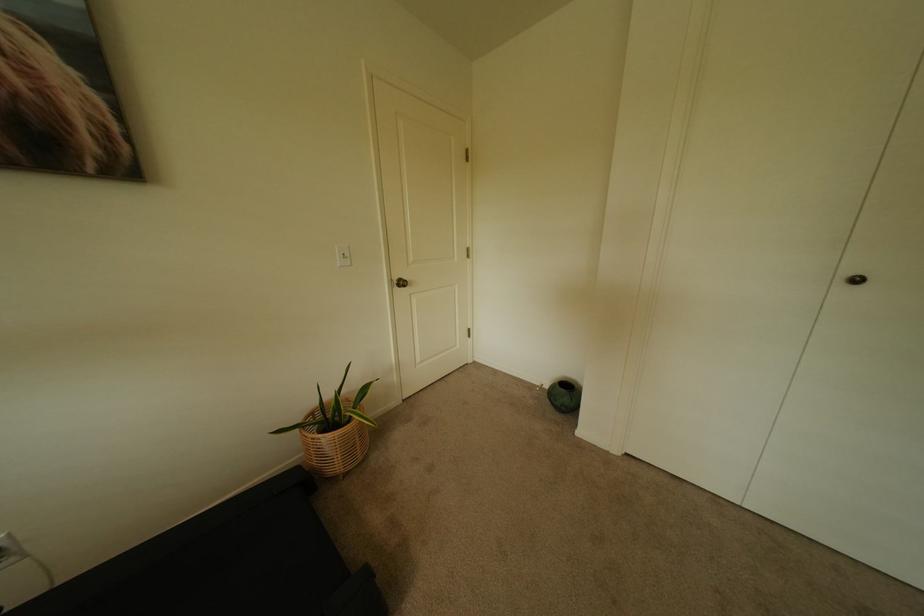
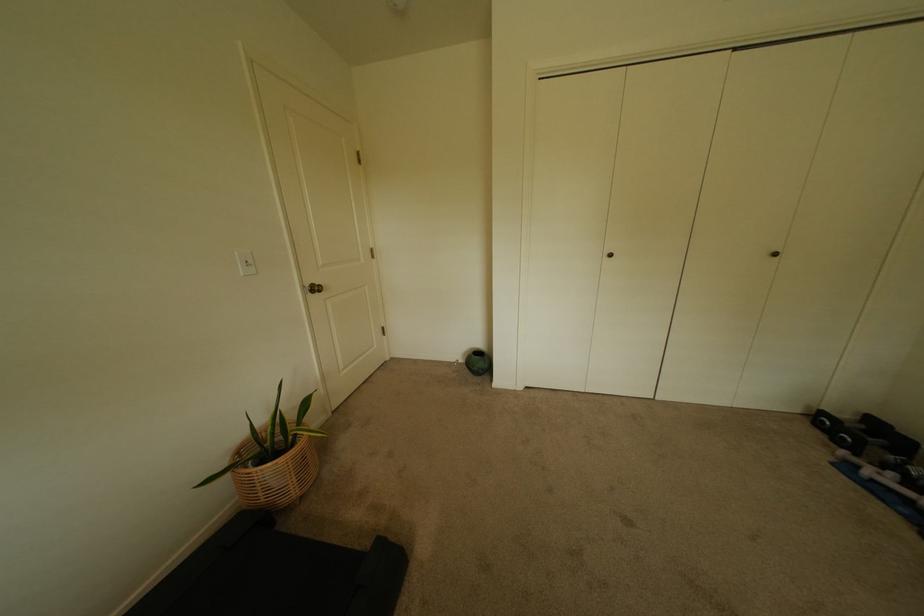
Question: How did the camera likely rotate?

Choices:
 (A) Left
 (B) Right
 (C) Up
 (D) Down

Answer: (B)